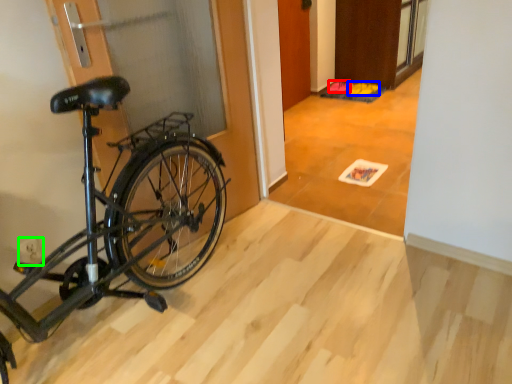
Question: Which object is the farthest from walking shoe (highlighted by a red box)? Choose among these: walking shoe (highlighted by a blue box) or power plugs and sockets (highlighted by a green box).

Choices:
 (A) walking shoe
 (B) power plugs and sockets

Answer: (B)